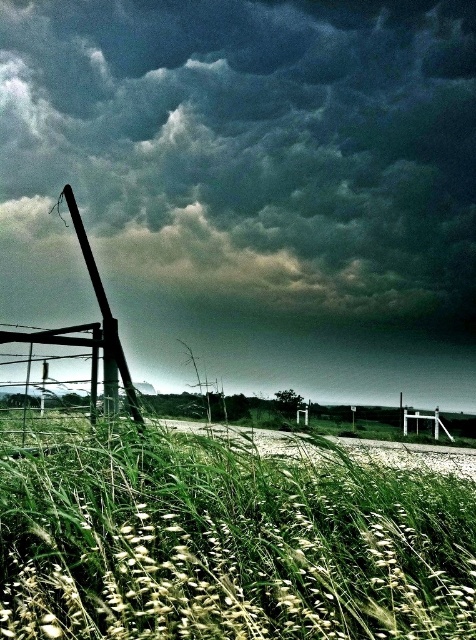
Question: Does dark gray cloud at upper center appear over metallic pole at left?

Choices:
 (A) yes
 (B) no

Answer: (A)

Question: Which of these objects is positioned farthest from the dark gray cloud at upper center?

Choices:
 (A) metallic pole at left
 (B) green grassy at lower center

Answer: (B)

Question: Can you confirm if dark gray cloud at upper center is positioned to the right of green grassy at lower center?

Choices:
 (A) no
 (B) yes

Answer: (B)

Question: Which point is closer to the camera?

Choices:
 (A) (329, 230)
 (B) (134, 412)

Answer: (B)

Question: Which point is closer to the camera?

Choices:
 (A) (265, 534)
 (B) (101, 307)

Answer: (A)

Question: Is dark gray cloud at upper center thinner than green grassy at lower center?

Choices:
 (A) yes
 (B) no

Answer: (B)